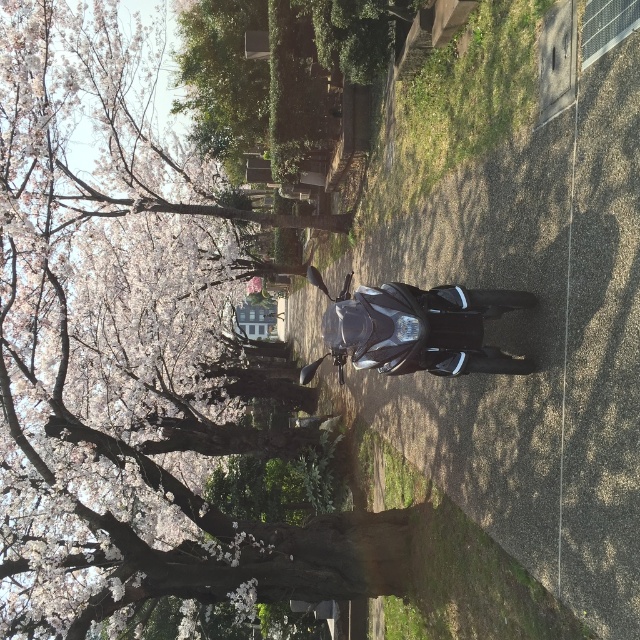
Who is lower down, smooth bark tree at center or glossy black motorcycle at center?

glossy black motorcycle at center

The width and height of the screenshot is (640, 640). Find the location of `smooth bark tree at center`. smooth bark tree at center is located at coordinates (131, 403).

Who is more distant from viewer, (42, 560) or (480, 289)?

The point (42, 560) is more distant.

Where is `smooth bark tree at center`? This screenshot has width=640, height=640. smooth bark tree at center is located at coordinates (131, 403).